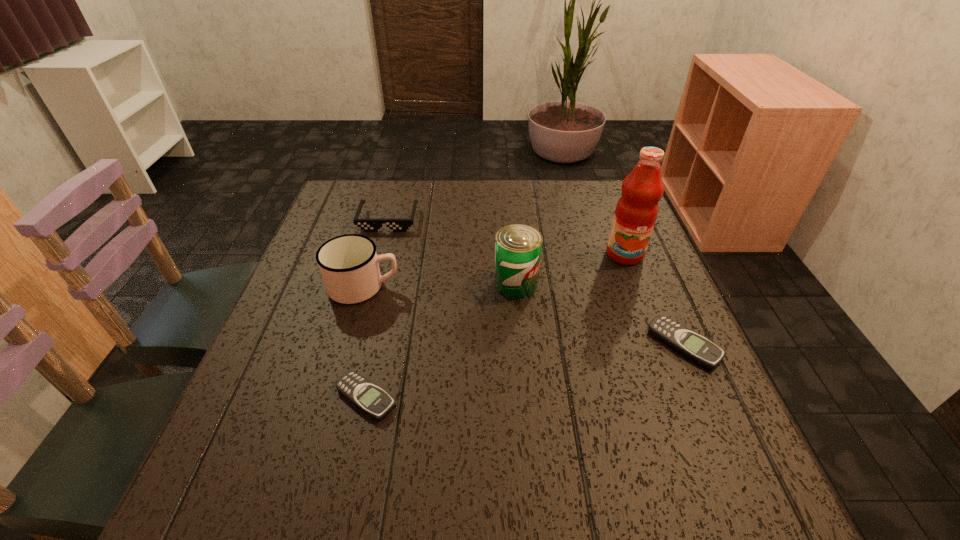
In order to click on free location at the near right corner in this screenshot , I will do `click(739, 444)`.

This screenshot has width=960, height=540. Find the location of `empty space that is in between the nearest object and the third tallest object`. empty space that is in between the nearest object and the third tallest object is located at coordinates (365, 342).

Where is `free space between the fourth shortest object and the fourth object from left to right`? The image size is (960, 540). free space between the fourth shortest object and the fourth object from left to right is located at coordinates (440, 285).

Where is `free space between the fourth shortest object and the second tallest object`? free space between the fourth shortest object and the second tallest object is located at coordinates (440, 285).

Identify the location of free space that is in between the shorter beeper and the tallest object. This screenshot has height=540, width=960. (495, 326).

Image resolution: width=960 pixels, height=540 pixels. I want to click on free space between the farther beeper and the shorter beeper, so click(x=525, y=371).

I want to click on vacant point located between the fourth object from left to right and the farthest object, so click(x=452, y=252).

This screenshot has width=960, height=540. Identify the location of free point between the second nearest object and the tallest object. coord(655,300).

Where is `free space between the fourth shortest object and the fifth tallest object`? This screenshot has width=960, height=540. free space between the fourth shortest object and the fifth tallest object is located at coordinates (524, 316).

Locate an element on the screen. Image resolution: width=960 pixels, height=540 pixels. object that stands as the fourth closest to the taller beeper is located at coordinates (349, 266).